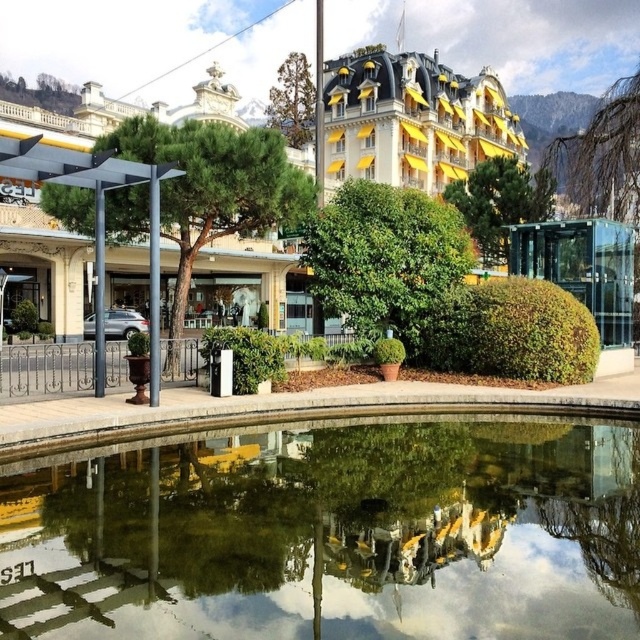
Does yellow awning building at upper center lie in front of bare branches at upper right?

No.

Which is behind, point (486, 122) or point (592, 173)?

Positioned behind is point (486, 122).

You are a GUI agent. You are given a task and a screenshot of the screen. Output one action in this format:
    pyautogui.click(x=<x>, y=<y>)
    Task: Click on the yellow awning building at upper center
    The width and height of the screenshot is (640, 640).
    Given the screenshot: What is the action you would take?
    coord(412,120)

Which is more to the right, green leafy bush at center or bare branches at upper right?

bare branches at upper right

Does point (342, 280) come in front of point (625, 97)?

That is True.

Does point (433, 276) come closer to viewer compared to point (630, 132)?

Yes, point (433, 276) is closer to viewer.

Where is `green leafy bush at center`? The image size is (640, 640). green leafy bush at center is located at coordinates (385, 257).

Does transparent glass pool at center appear over green leafy tree at left?

No.

Between transparent glass pool at center and green leafy tree at left, which one is positioned lower?

transparent glass pool at center

Find the location of a particular element. This screenshot has height=640, width=640. transparent glass pool at center is located at coordinates (330, 532).